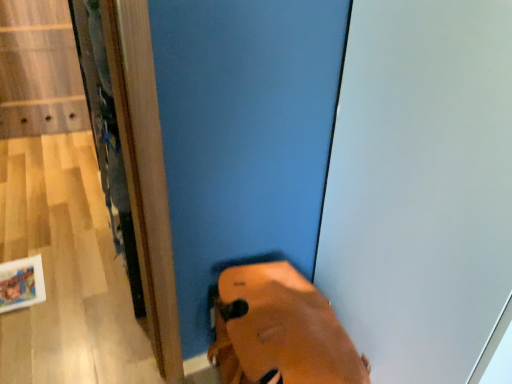
Question: From a real-world perspective, is white glossy screen door at upper right located beneath leather shoe at lower center?

Choices:
 (A) no
 (B) yes

Answer: (A)

Question: Is white glossy screen door at upper right looking in the opposite direction of leather shoe at lower center?

Choices:
 (A) yes
 (B) no

Answer: (B)

Question: Can you confirm if white glossy screen door at upper right is positioned to the left of leather shoe at lower center?

Choices:
 (A) yes
 (B) no

Answer: (B)

Question: Considering the relative sizes of white glossy screen door at upper right and leather shoe at lower center in the image provided, is white glossy screen door at upper right smaller than leather shoe at lower center?

Choices:
 (A) yes
 (B) no

Answer: (B)

Question: Is the depth of white glossy screen door at upper right greater than that of leather shoe at lower center?

Choices:
 (A) no
 (B) yes

Answer: (A)

Question: Considering the relative sizes of white glossy screen door at upper right and leather shoe at lower center in the image provided, is white glossy screen door at upper right wider than leather shoe at lower center?

Choices:
 (A) no
 (B) yes

Answer: (B)

Question: Would you say white glossy screen door at upper right is part of leather shoe at lower center's contents?

Choices:
 (A) yes
 (B) no

Answer: (B)

Question: From a real-world perspective, is leather shoe at lower center over white glossy screen door at upper right?

Choices:
 (A) yes
 (B) no

Answer: (B)

Question: Is the position of leather shoe at lower center less distant than that of white glossy screen door at upper right?

Choices:
 (A) no
 (B) yes

Answer: (A)

Question: Does leather shoe at lower center have a lesser width compared to white glossy screen door at upper right?

Choices:
 (A) no
 (B) yes

Answer: (B)

Question: Does leather shoe at lower center have a greater height compared to white glossy screen door at upper right?

Choices:
 (A) no
 (B) yes

Answer: (A)

Question: Is leather shoe at lower center positioned beyond the bounds of white glossy screen door at upper right?

Choices:
 (A) yes
 (B) no

Answer: (A)

Question: Is white glossy screen door at upper right wider or thinner than leather shoe at lower center?

Choices:
 (A) wide
 (B) thin

Answer: (A)